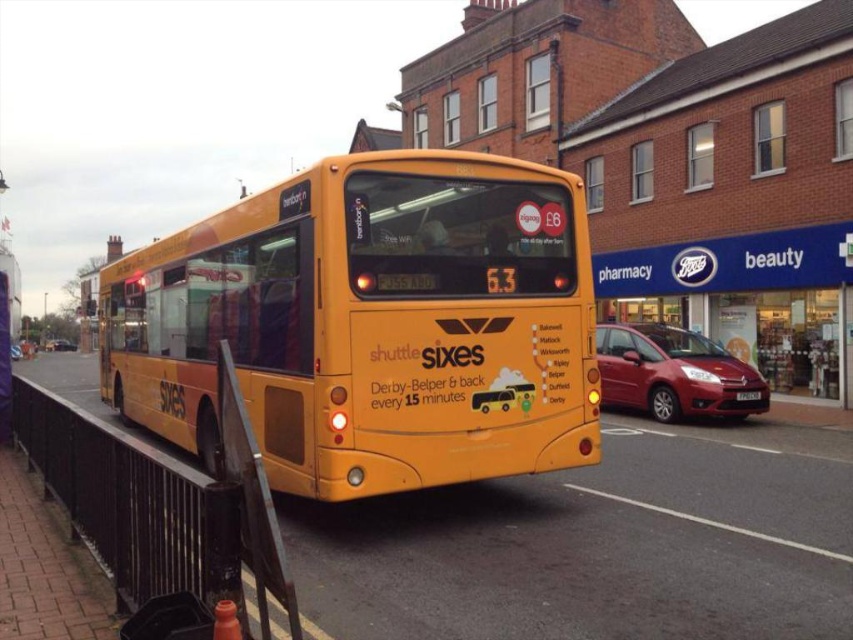
You are standing in front of the yellow shuttle bus and want to take a photo. The bus has two points marked on its side at coordinates point (741, 401) and point (16, 349). Which point will appear larger in your photo?

Point (741, 401) is closer to the camera than point 0.547, 020, so it will appear larger in the photo.

You are a pedestrian standing on the sidewalk next to the fence. You need to cross the road to reach the shiny black car at center and the metallic silver car at center. Which car should you approach first if you want to reach the smaller one?

A: You should approach the shiny black car at center first because it is smaller than the metallic silver car at center.

You are a pedestrian standing on the sidewalk looking at the metallic silver car at center and the black plastic license plate at rear. Which object is closer to the ground?

The black plastic license plate at rear is below metallic silver car at center, so it is closer to the ground.